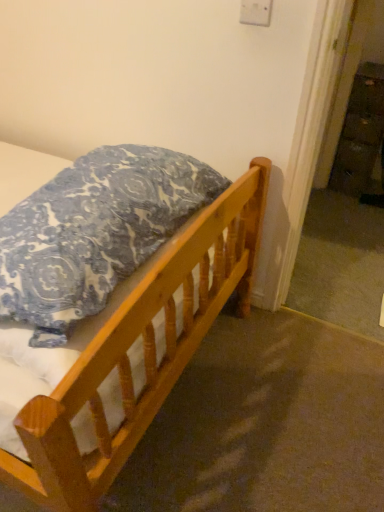
The height and width of the screenshot is (512, 384). Describe the element at coordinates (360, 132) in the screenshot. I see `wooden dresser at right` at that location.

This screenshot has width=384, height=512. What are the coordinates of `blue patterned pillow at upper left` in the screenshot? It's located at (94, 232).

Where is `wooden dresser at right`? This screenshot has height=512, width=384. wooden dresser at right is located at coordinates (360, 132).

Is blue patterned pillow at upper left completely or partially outside of wooden bed at lower left?

That's correct, blue patterned pillow at upper left is outside of wooden bed at lower left.

Which object is thinner, blue patterned pillow at upper left or wooden bed at lower left?

blue patterned pillow at upper left.

From a real-world perspective, is blue patterned pillow at upper left over wooden bed at lower left?

Yes.

Is blue patterned pillow at upper left bigger or smaller than wooden bed at lower left?

In the image, blue patterned pillow at upper left appears to be larger than wooden bed at lower left.

Can you tell me how much wooden bed at lower left and blue patterned pillow at upper left differ in facing direction?

178 degrees.

Find the location of a particular element. The height and width of the screenshot is (512, 384). pillow above the wooden bed at lower left (from a real-world perspective) is located at coordinates (94, 232).

Measure the distance between wooden bed at lower left and blue patterned pillow at upper left.

wooden bed at lower left and blue patterned pillow at upper left are 6.36 inches apart from each other.

In the scene shown: Is wooden bed at lower left with blue patterned pillow at upper left?

wooden bed at lower left is not next to blue patterned pillow at upper left, and they're not touching.

Can you see wooden dresser at right touching blue patterned pillow at upper left?

No, wooden dresser at right is not making contact with blue patterned pillow at upper left.

In the scene shown: Is wooden dresser at right positioned with its back to blue patterned pillow at upper left?

No.

Considering their positions, is wooden dresser at right located in front of or behind blue patterned pillow at upper left?

Visually, wooden dresser at right is located behind blue patterned pillow at upper left.

How many degrees apart are the facing directions of wooden dresser at right and blue patterned pillow at upper left?

89.3 degrees.

Is blue patterned pillow at upper left bigger than wooden dresser at right?

Indeed, blue patterned pillow at upper left has a larger size compared to wooden dresser at right.

Which is in front, point (161, 160) or point (373, 100)?

Positioned in front is point (161, 160).

What's the angular difference between blue patterned pillow at upper left and wooden dresser at right's facing directions?

They differ by 89.3 degrees in their facing directions.

Which object is positioned more to the right, blue patterned pillow at upper left or wooden dresser at right?

Positioned to the right is wooden dresser at right.

From a real-world perspective, is wooden dresser at right on top of wooden bed at lower left?

Correct, in the physical world, wooden dresser at right is higher than wooden bed at lower left.

Does wooden dresser at right touch wooden bed at lower left?

No, wooden dresser at right is not next to wooden bed at lower left.

Between point (354, 78) and point (45, 487), which one is positioned behind?

Positioned behind is point (354, 78).

Can you confirm if wooden dresser at right is positioned to the right of wooden bed at lower left?

Correct, you'll find wooden dresser at right to the right of wooden bed at lower left.

From a real-world perspective, which object rests below the other?

wooden bed at lower left is physically lower.

Considering the positions of points (192, 337) and (374, 73), is point (192, 337) closer to camera compared to point (374, 73)?

Yes, it is in front of point (374, 73).

Is wooden bed at lower left wider or thinner than wooden dresser at right?

Clearly, wooden bed at lower left has more width compared to wooden dresser at right.

Where is `bed behind the blue patterned pillow at upper left`? This screenshot has height=512, width=384. bed behind the blue patterned pillow at upper left is located at coordinates (132, 353).

This screenshot has height=512, width=384. Identify the location of pillow lying on the left of wooden bed at lower left. (94, 232).

Considering their positions, is wooden bed at lower left positioned further to blue patterned pillow at upper left than wooden dresser at right?

wooden dresser at right is further to blue patterned pillow at upper left.

Estimate the real-world distances between objects in this image. Which object is closer to wooden bed at lower left, wooden dresser at right or blue patterned pillow at upper left?

Among the two, blue patterned pillow at upper left is located nearer to wooden bed at lower left.

Considering their positions, is wooden dresser at right positioned closer to blue patterned pillow at upper left than wooden bed at lower left?

wooden bed at lower left.

From the image, which object appears to be farther from wooden bed at lower left, blue patterned pillow at upper left or wooden dresser at right?

wooden dresser at right.

Which object lies further to the anchor point wooden dresser at right, wooden bed at lower left or blue patterned pillow at upper left?

blue patterned pillow at upper left lies further to wooden dresser at right than the other object.

From the image, which object appears to be farther from wooden dresser at right, blue patterned pillow at upper left or wooden bed at lower left?

Based on the image, blue patterned pillow at upper left appears to be further to wooden dresser at right.

Identify the location of bed between blue patterned pillow at upper left and wooden dresser at right from front to back. Image resolution: width=384 pixels, height=512 pixels. (132, 353).